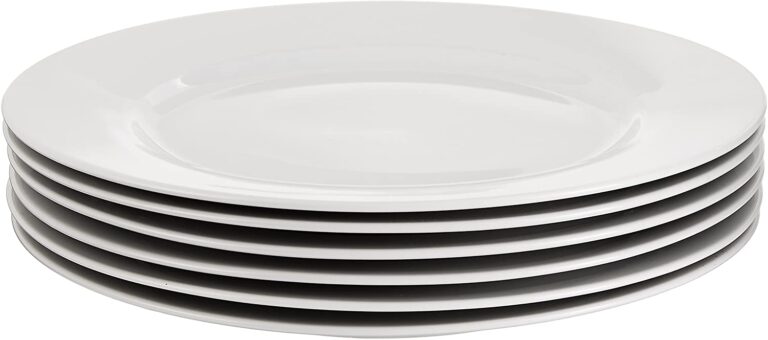
In order to click on plates in this screenshot , I will do `click(227, 319)`, `click(257, 299)`, `click(282, 276)`, `click(309, 249)`, `click(329, 229)`, `click(351, 208)`.